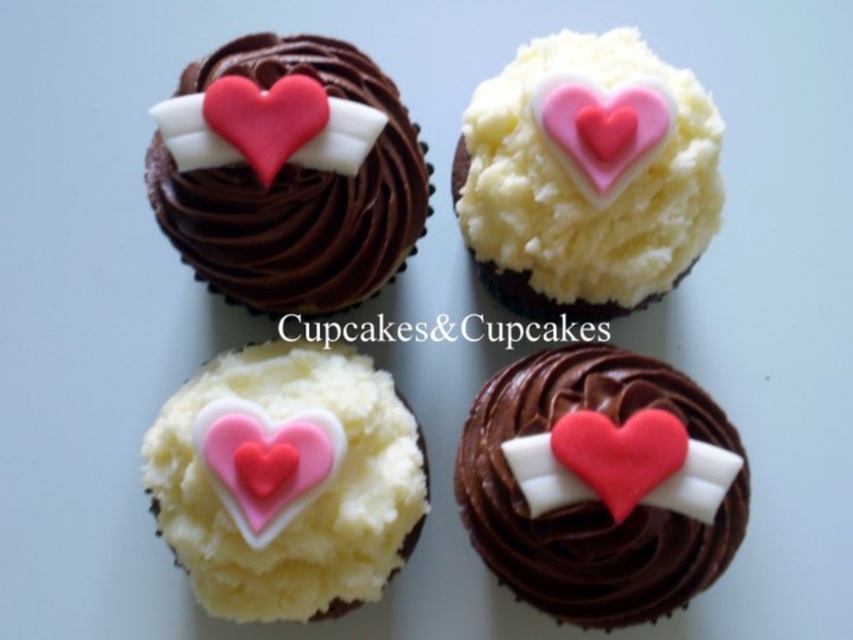
Based on the photo, does pink glossy heart at center have a greater height compared to matte pink fondant heart at bottom right?

Correct, pink glossy heart at center is much taller as matte pink fondant heart at bottom right.

Does pink glossy heart at center appear under matte pink fondant heart at bottom right?

Yes, pink glossy heart at center is below matte pink fondant heart at bottom right.

What do you see at coordinates (265, 461) in the screenshot? This screenshot has width=853, height=640. I see `pink glossy heart at center` at bounding box center [265, 461].

Where is `pink glossy heart at center`? pink glossy heart at center is located at coordinates (265, 461).

Who is more distant from viewer, (x=653, y=150) or (x=323, y=196)?

The point (x=323, y=196) is more distant.

Is white fluffy cupcake at upper right above chocolate matte heart at upper left?

Correct, white fluffy cupcake at upper right is located above chocolate matte heart at upper left.

Does point (622, 209) come behind point (369, 204)?

No, (622, 209) is closer to viewer.

Where is `white fluffy cupcake at upper right`? white fluffy cupcake at upper right is located at coordinates (587, 177).

Can you confirm if white fluffy cupcake at upper right is wider than pink fondant heart at upper center?

Correct, the width of white fluffy cupcake at upper right exceeds that of pink fondant heart at upper center.

Between point (566, 132) and point (606, 180), which one is positioned in front?

Positioned in front is point (606, 180).

The width and height of the screenshot is (853, 640). What are the coordinates of `white fluffy cupcake at upper right` in the screenshot? It's located at (587, 177).